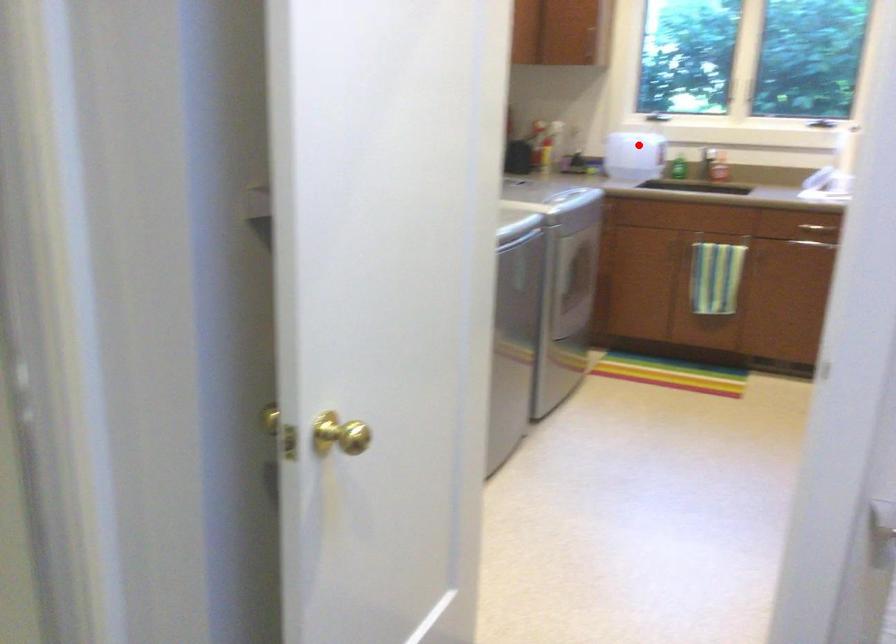
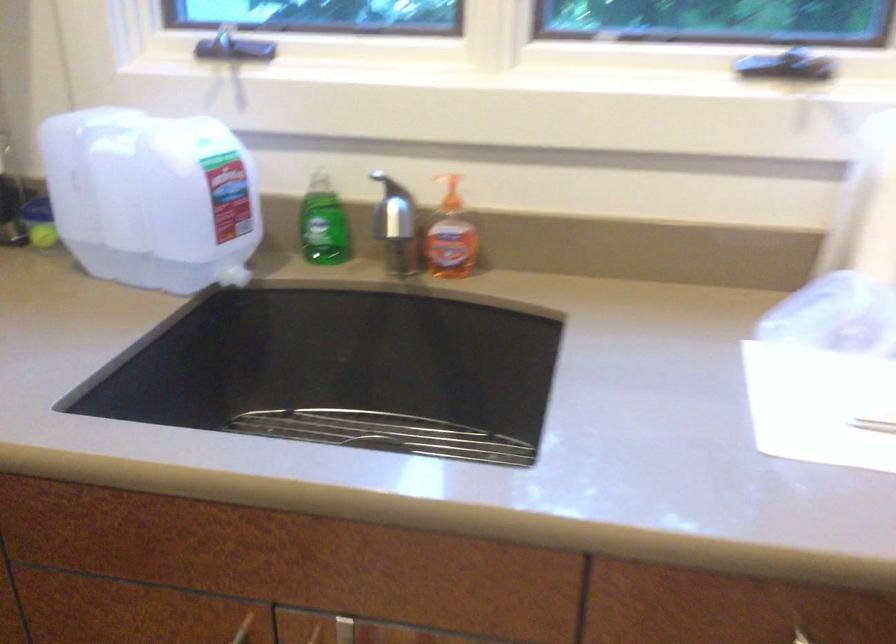
Question: I am providing you with two images of the same scene from different viewpoints. In image1, a red point is highlighted. Considering the same 3D point in image2, which of the following is correct?

Choices:
 (A) It is closer
 (B) It is farther

Answer: (A)